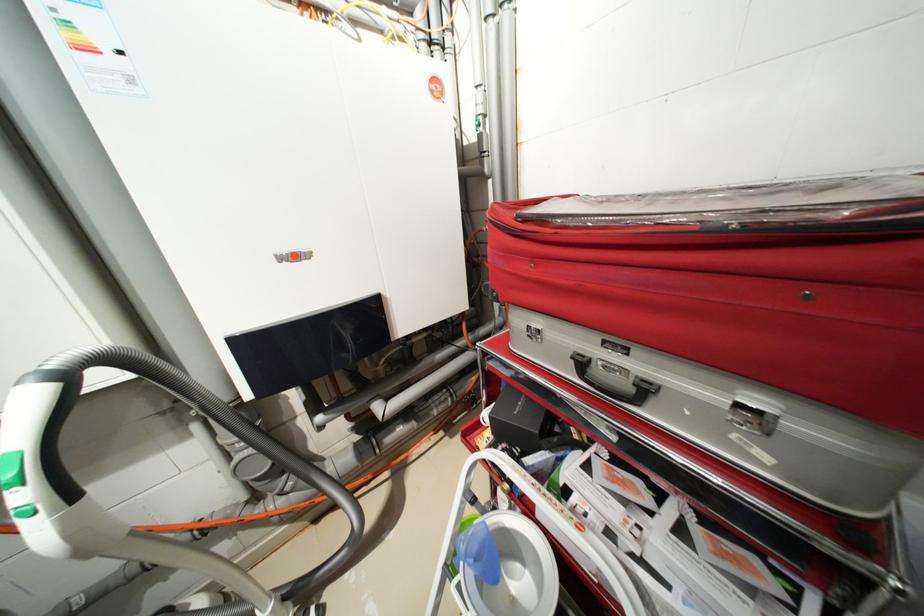
What do you see at coordinates (23, 511) in the screenshot? I see `the green vacuum button` at bounding box center [23, 511].